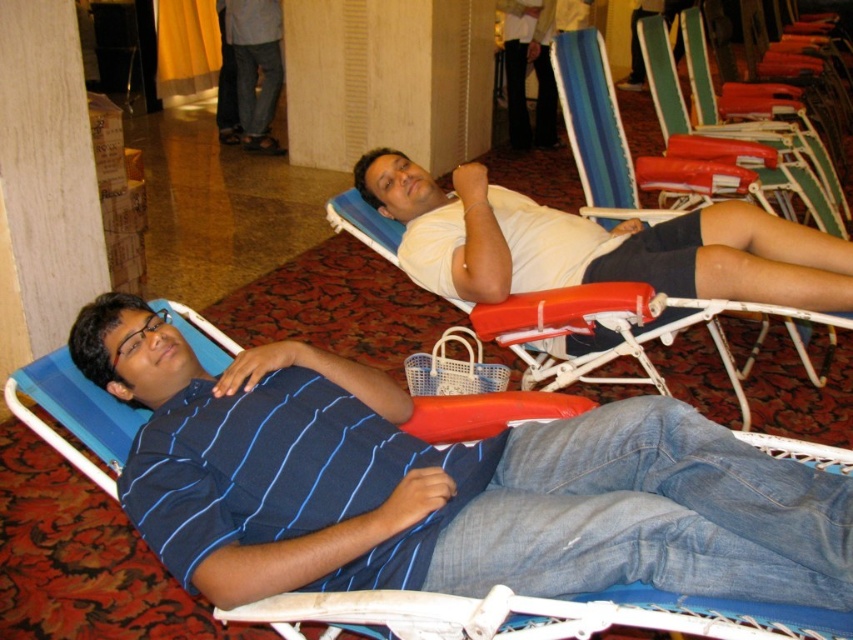
Between blue striped shirt at left and orange plastic beach chair at center, which one appears on the left side from the viewer's perspective?

Positioned to the left is blue striped shirt at left.

Who is more distant from viewer, (669,492) or (364,218)?

The point (364,218) is behind.

This screenshot has width=853, height=640. Find the location of `blue striped shirt at left`. blue striped shirt at left is located at coordinates (442, 484).

Does blue striped shirt at left appear on the left side of white matte shirt at upper center?

Correct, you'll find blue striped shirt at left to the left of white matte shirt at upper center.

Is blue striped shirt at left positioned behind white matte shirt at upper center?

That is False.

Where is `blue striped shirt at left`? This screenshot has height=640, width=853. blue striped shirt at left is located at coordinates (442, 484).

Does white matte shirt at upper center appear on the right side of orange plastic beach chair at center?

In fact, white matte shirt at upper center is to the left of orange plastic beach chair at center.

This screenshot has height=640, width=853. What are the coordinates of `white matte shirt at upper center` in the screenshot? It's located at (735, 259).